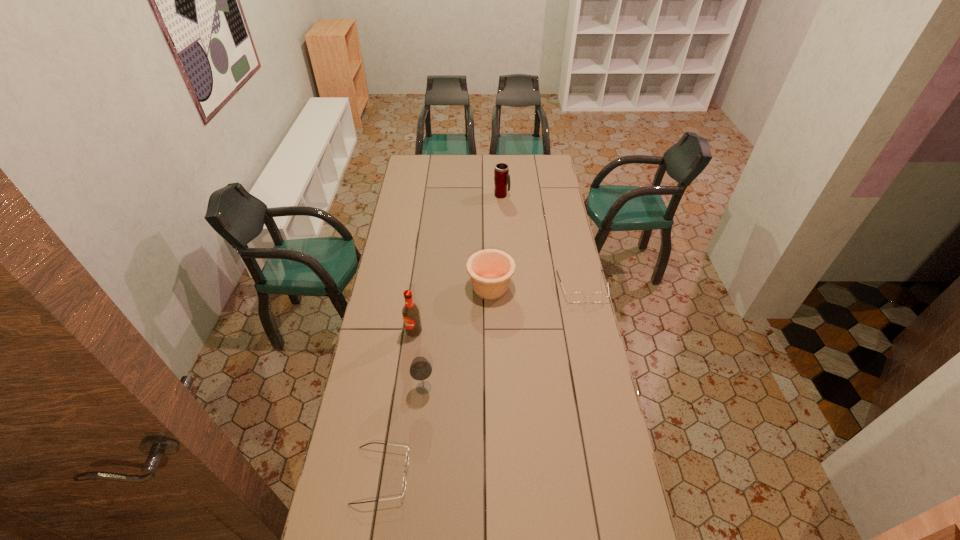
The width and height of the screenshot is (960, 540). In order to click on the nearest object in this screenshot , I will do `click(407, 453)`.

Image resolution: width=960 pixels, height=540 pixels. I want to click on the nearer spectacles, so click(407, 453).

Where is `the farther spectacles`? The width and height of the screenshot is (960, 540). the farther spectacles is located at coordinates (575, 297).

The height and width of the screenshot is (540, 960). Find the location of `the rightmost object`. the rightmost object is located at coordinates (575, 297).

Locate an element on the screen. beer bottle is located at coordinates (411, 316).

The width and height of the screenshot is (960, 540). Identify the location of the third nearest object. (411, 316).

Image resolution: width=960 pixels, height=540 pixels. I want to click on thermos bottle, so click(501, 172).

Image resolution: width=960 pixels, height=540 pixels. What are the coordinates of `pottery` in the screenshot? It's located at (490, 270).

In order to click on the second nearest object in this screenshot , I will do `click(420, 369)`.

The image size is (960, 540). Find the location of `free space located through the lenses of the nearer spectacles`. free space located through the lenses of the nearer spectacles is located at coordinates coord(430,475).